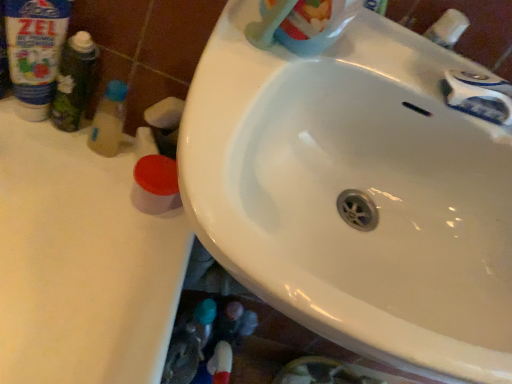
Question: Looking at the image, does white glossy sink at center seem bigger or smaller compared to blue plastic bottle at upper left, positioned as the second cleaning product in right-to-left order?

Choices:
 (A) big
 (B) small

Answer: (A)

Question: Is white glossy sink at center in front of or behind blue plastic bottle at upper left, positioned as the second cleaning product in right-to-left order, in the image?

Choices:
 (A) front
 (B) behind

Answer: (A)

Question: Which of these objects is positioned farthest from the white glossy sink at center?

Choices:
 (A) white plastic toothbrush at upper right
 (B) white plastic faucet at upper right
 (C) translucent plastic bottle at left, the 1th toiletry viewed from the right
 (D) translucent plastic toothbrush at upper center, the 2th cleaning product in the left-to-right sequence
 (E) blue plastic bottle at upper left, positioned as the first cleaning product in back-to-front order

Answer: (E)

Question: Which of these objects is positioned closest to the white glossy sink at center?

Choices:
 (A) blue plastic bottle at upper left, acting as the 2th cleaning product starting from the front
 (B) translucent plastic bottle at left, the 1th toiletry viewed from the right
 (C) translucent plastic toothbrush at upper center, which is counted as the 1th cleaning product, starting from the right
 (D) white plastic toothbrush at upper right
 (E) green matte bottle at left, acting as the first toiletry starting from the left

Answer: (C)